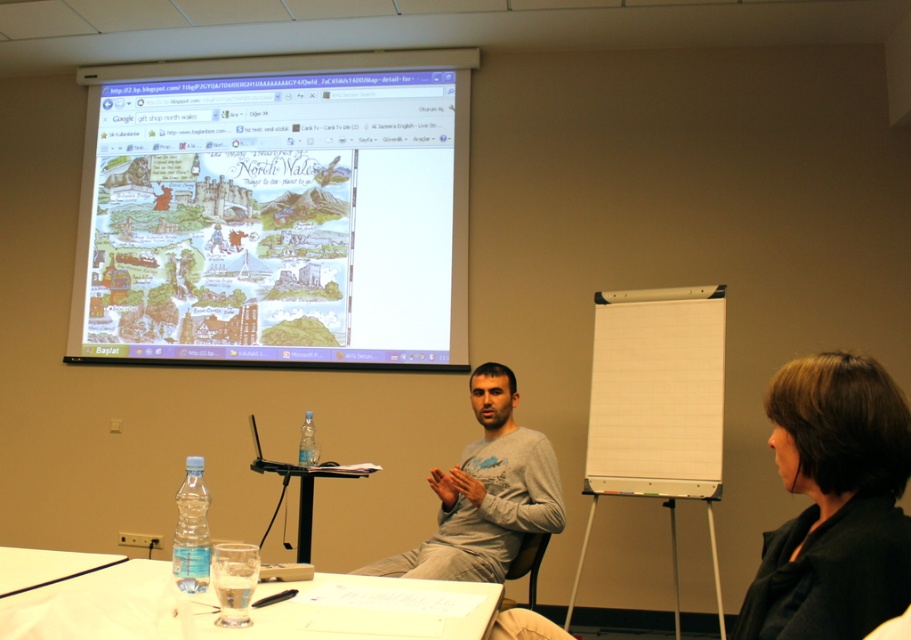
You are a guest entering the classroom and see the black matte jacket at lower right and the clear plastic table at lower left. Which object is closer to the right side of the room?

The black matte jacket at lower right is closer to the right side of the room because it is positioned on the right side of the clear plastic table at lower left.

You are standing in the classroom and want to take a photo of the point at coordinates (865, 365). If your camera is 4.48 feet away from that point, is the camera positioned correctly to capture the point in the photo?

Yes, the camera is positioned correctly because the point at coordinates (865, 365) and the camera are 4.48 feet apart, which means the camera is at the correct distance to capture the point in the photo.

You are a photographer standing at the front of the room. You want to take a photo of the presentation scene so that the black matte jacket at lower right is clearly visible. Considering the jacket is 1.13 meters away from your camera, what is the minimum distance your camera should be from the table where the presenter is seated?

The black matte jacket at lower right is 1.13 meters from the camera. To ensure it is clearly visible in the photo, the camera should be positioned at least 1.13 meters away from the table where the presenter is seated.